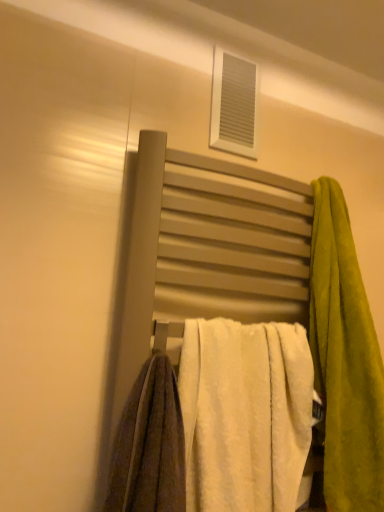
In order to face white plastic vent at upper center, should I rotate leftwards or rightwards?

Rotate right and turn 6.232 degrees.

This screenshot has width=384, height=512. In order to click on green plush towel at right, the first towel from the right in this screenshot , I will do `click(345, 359)`.

In terms of height, does matte gray towel rack at center look taller or shorter compared to green plush towel at right, the first towel from the right?

matte gray towel rack at center is taller than green plush towel at right, the first towel from the right.

Does point (305, 203) come behind point (370, 439)?

Yes, it is.

Who is smaller, matte gray towel rack at center or green plush towel at right, the first towel from the right?

With smaller size is green plush towel at right, the first towel from the right.

In terms of width, does matte gray towel rack at center look wider or thinner when compared to green plush towel at right, which is the 2th towel in left-to-right order?

Clearly, matte gray towel rack at center has less width compared to green plush towel at right, which is the 2th towel in left-to-right order.

Are white fluffy towel at center, the second towel viewed from the right, and green plush towel at right, the first towel from the right, beside each other?

No, white fluffy towel at center, the second towel viewed from the right, is not next to green plush towel at right, the first towel from the right.

Considering the positions of objects white fluffy towel at center, the second towel viewed from the right, and green plush towel at right, which is the 2th towel in left-to-right order, in the image provided, who is more to the left, white fluffy towel at center, the second towel viewed from the right, or green plush towel at right, which is the 2th towel in left-to-right order,?

Positioned to the left is white fluffy towel at center, the second towel viewed from the right.

Relative to green plush towel at right, which is the 2th towel in left-to-right order, is white fluffy towel at center, the 1th towel when ordered from left to right, in front or behind?

Clearly, white fluffy towel at center, the 1th towel when ordered from left to right, is in front of green plush towel at right, which is the 2th towel in left-to-right order.

From the image's perspective, is matte gray towel rack at center beneath white fluffy towel at center, the 1th towel when ordered from left to right?

No, from the image's perspective, matte gray towel rack at center is not below white fluffy towel at center, the 1th towel when ordered from left to right.

Is matte gray towel rack at center thinner than white fluffy towel at center, the second towel viewed from the right?

Yes.

Which point is more forward, (314, 356) or (202, 422)?

The point (202, 422) is closer to the camera.

Considering the positions of objects matte gray towel rack at center and white fluffy towel at center, the 1th towel when ordered from left to right, in the image provided, who is more to the right, matte gray towel rack at center or white fluffy towel at center, the 1th towel when ordered from left to right,?

white fluffy towel at center, the 1th towel when ordered from left to right.

Is green plush towel at right, the first towel from the right, taller than matte gray towel rack at center?

No.

Looking at this image, is green plush towel at right, which is the 2th towel in left-to-right order, to the right of matte gray towel rack at center from the viewer's perspective?

Yes, green plush towel at right, which is the 2th towel in left-to-right order, is to the right of matte gray towel rack at center.

Where is `bed on the left of green plush towel at right, which is the 2th towel in left-to-right order`? Image resolution: width=384 pixels, height=512 pixels. bed on the left of green plush towel at right, which is the 2th towel in left-to-right order is located at coordinates click(x=254, y=284).

From a real-world perspective, is green plush towel at right, which is the 2th towel in left-to-right order, located beneath matte gray towel rack at center?

No, from a real-world perspective, green plush towel at right, which is the 2th towel in left-to-right order, is not beneath matte gray towel rack at center.

Considering the positions of objects white fluffy towel at center, the 1th towel when ordered from left to right, and white plastic vent at upper center in the image provided, who is behind, white fluffy towel at center, the 1th towel when ordered from left to right, or white plastic vent at upper center?

white plastic vent at upper center is further from the camera.

Considering the sizes of white fluffy towel at center, the 1th towel when ordered from left to right, and white plastic vent at upper center in the image, is white fluffy towel at center, the 1th towel when ordered from left to right, wider or thinner than white plastic vent at upper center?

In the image, white fluffy towel at center, the 1th towel when ordered from left to right, appears to be wider than white plastic vent at upper center.

From the image's perspective, is white fluffy towel at center, the second towel viewed from the right, positioned above or below white plastic vent at upper center?

Clearly, from the image's perspective, white fluffy towel at center, the second towel viewed from the right, is below white plastic vent at upper center.

At what (x,y) coordinates should I click in order to perform the action: click on window lying on the left of white fluffy towel at center, the 1th towel when ordered from left to right. Please return your answer as a coordinate pair (x, y). The width and height of the screenshot is (384, 512). Looking at the image, I should click on (234, 105).

Can you confirm if green plush towel at right, which is the 2th towel in left-to-right order, is wider than white fluffy towel at center, the second towel viewed from the right?

Indeed, green plush towel at right, which is the 2th towel in left-to-right order, has a greater width compared to white fluffy towel at center, the second towel viewed from the right.

Considering the sizes of objects green plush towel at right, which is the 2th towel in left-to-right order, and white fluffy towel at center, the second towel viewed from the right, in the image provided, who is taller, green plush towel at right, which is the 2th towel in left-to-right order, or white fluffy towel at center, the second towel viewed from the right,?

green plush towel at right, which is the 2th towel in left-to-right order, is taller.

Is white fluffy towel at center, the 1th towel when ordered from left to right, surrounded by green plush towel at right, which is the 2th towel in left-to-right order?

No, green plush towel at right, which is the 2th towel in left-to-right order, does not contain white fluffy towel at center, the 1th towel when ordered from left to right.

How many degrees apart are the facing directions of green plush towel at right, the first towel from the right, and white fluffy towel at center, the 1th towel when ordered from left to right?

green plush towel at right, the first towel from the right, and white fluffy towel at center, the 1th towel when ordered from left to right, are facing 0.000266 degrees away from each other.

Considering the relative sizes of green plush towel at right, the first towel from the right, and white plastic vent at upper center in the image provided, is green plush towel at right, the first towel from the right, bigger than white plastic vent at upper center?

Indeed, green plush towel at right, the first towel from the right, has a larger size compared to white plastic vent at upper center.

At what (x,y) coordinates should I click in order to perform the action: click on towel that is the 1st object located below the white plastic vent at upper center (from the image's perspective). Please return your answer as a coordinate pair (x, y). The image size is (384, 512). Looking at the image, I should click on (345, 359).

From the picture: Is green plush towel at right, which is the 2th towel in left-to-right order, to the left of white plastic vent at upper center from the viewer's perspective?

No.

Looking at this image, is green plush towel at right, which is the 2th towel in left-to-right order, completely or partially outside of white plastic vent at upper center?

That's correct, green plush towel at right, which is the 2th towel in left-to-right order, is outside of white plastic vent at upper center.

The image size is (384, 512). I want to click on bed to the left of green plush towel at right, the first towel from the right, so click(254, 284).

Locate an element on the screen. This screenshot has height=512, width=384. towel above the white fluffy towel at center, the 1th towel when ordered from left to right (from a real-world perspective) is located at coordinates (345, 359).

Based on their spatial positions, is matte gray towel rack at center or green plush towel at right, which is the 2th towel in left-to-right order, closer to white plastic vent at upper center?

matte gray towel rack at center is closer to white plastic vent at upper center.

Looking at this image, considering their positions, is matte gray towel rack at center positioned closer to green plush towel at right, the first towel from the right, than white plastic vent at upper center?

matte gray towel rack at center is positioned closer to the anchor green plush towel at right, the first towel from the right.

From the image, which object appears to be farther from matte gray towel rack at center, white plastic vent at upper center or white fluffy towel at center, the 1th towel when ordered from left to right?

white plastic vent at upper center is further to matte gray towel rack at center.

From the image, which object appears to be farther from white fluffy towel at center, the second towel viewed from the right, matte gray towel rack at center or white plastic vent at upper center?

white plastic vent at upper center is positioned further to the anchor white fluffy towel at center, the second towel viewed from the right.

From the image, which object appears to be nearer to matte gray towel rack at center, green plush towel at right, which is the 2th towel in left-to-right order, or white plastic vent at upper center?

green plush towel at right, which is the 2th towel in left-to-right order, lies closer to matte gray towel rack at center than the other object.

From the image, which object appears to be farther from white plastic vent at upper center, green plush towel at right, the first towel from the right, or matte gray towel rack at center?

green plush towel at right, the first towel from the right.

Which object lies further to the anchor point white plastic vent at upper center, matte gray towel rack at center or white fluffy towel at center, the second towel viewed from the right?

white fluffy towel at center, the second towel viewed from the right, is further to white plastic vent at upper center.

When comparing their distances from white fluffy towel at center, the second towel viewed from the right, does white plastic vent at upper center or matte gray towel rack at center seem further?

white plastic vent at upper center is positioned further to the anchor white fluffy towel at center, the second towel viewed from the right.

Where is `towel located between matte gray towel rack at center and green plush towel at right, which is the 2th towel in left-to-right order, in the left-right direction`? towel located between matte gray towel rack at center and green plush towel at right, which is the 2th towel in left-to-right order, in the left-right direction is located at coordinates (245, 414).

At what (x,y) coordinates should I click in order to perform the action: click on bed between white plastic vent at upper center and white fluffy towel at center, the second towel viewed from the right, from top to bottom. Please return your answer as a coordinate pair (x, y). Looking at the image, I should click on (254, 284).

At what (x,y) coordinates should I click in order to perform the action: click on towel between white plastic vent at upper center and matte gray towel rack at center vertically. Please return your answer as a coordinate pair (x, y). Looking at the image, I should click on (345, 359).

Find the location of a particular element. The image size is (384, 512). towel between white plastic vent at upper center and white fluffy towel at center, the second towel viewed from the right, from top to bottom is located at coordinates (345, 359).